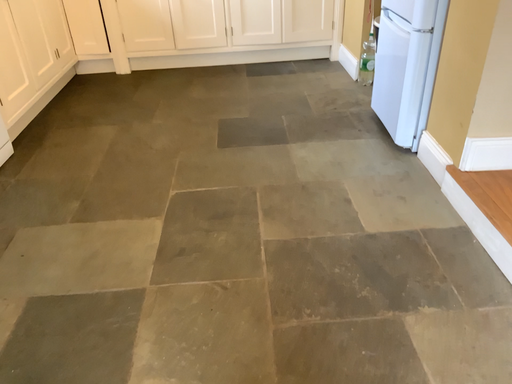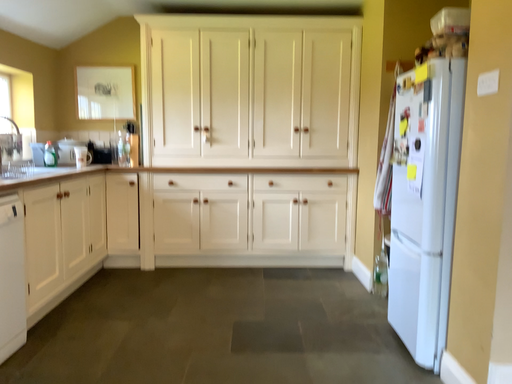
Question: How did the camera likely rotate when shooting the video?

Choices:
 (A) rotated upward
 (B) rotated downward

Answer: (A)